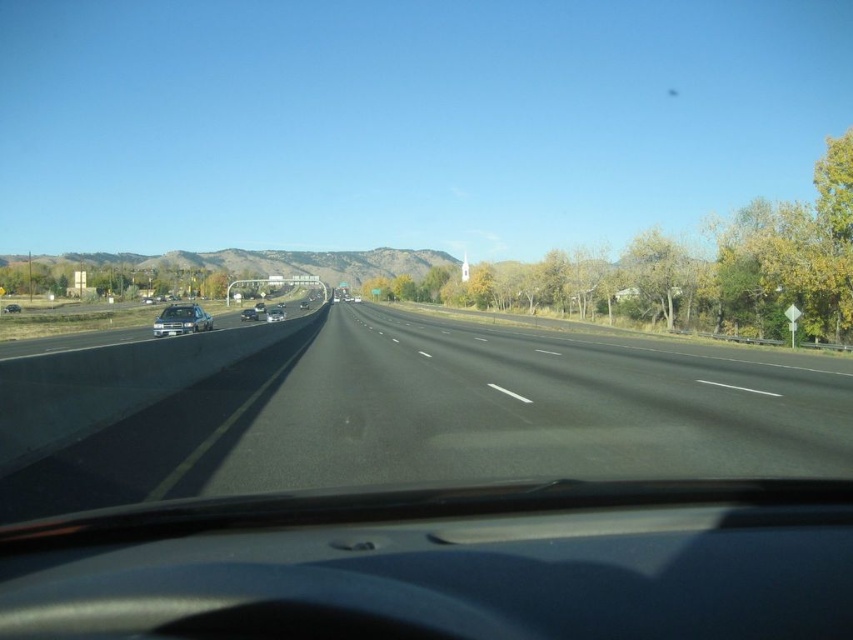
You are driving a car that is 5 meters long. You see a satin silver sedan at center and a shiny black sedan at left. Can you safely pass between them without changing lanes?

The distance between the satin silver sedan at center and the shiny black sedan at left is 33.88 meters. Since your car is only 5 meters long, there is sufficient space to safely pass between them without changing lanes.

You are a driver who wants to know if the black asphalt highway at center can accommodate the satin silver sedan at center. Based on their sizes, will the sedan fit within the highway?

The black asphalt highway at center has a larger size compared to satin silver sedan at center, so the sedan will fit within the highway.

You are driving a car and notice two points on the road ahead. The first point is at coordinates point (277,321) and the second is at point (16,308). Which point is closer to your current position?

Point (16,308) is closer to your current position because it is behind point (277,321), which is in front of it.